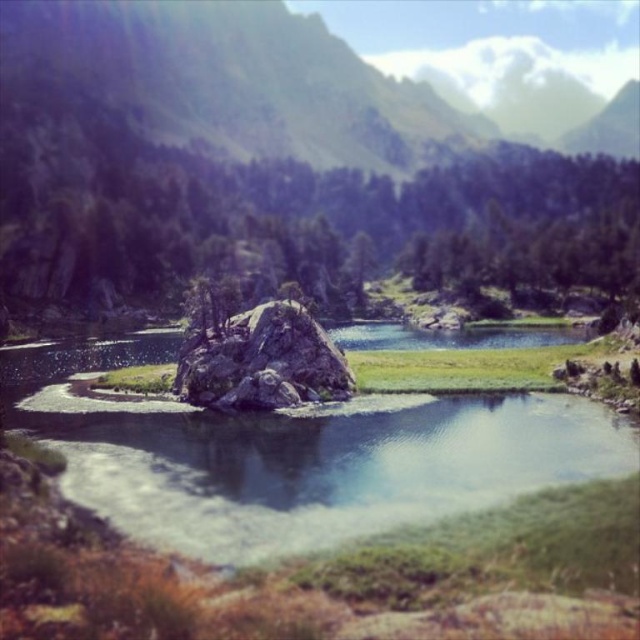
Which is above, green textured rock at center or smooth rock at center?

green textured rock at center is higher up.

In order to click on green textured rock at center in this screenshot , I will do point(284,212).

Identify the location of green textured rock at center. This screenshot has height=640, width=640. (284, 212).